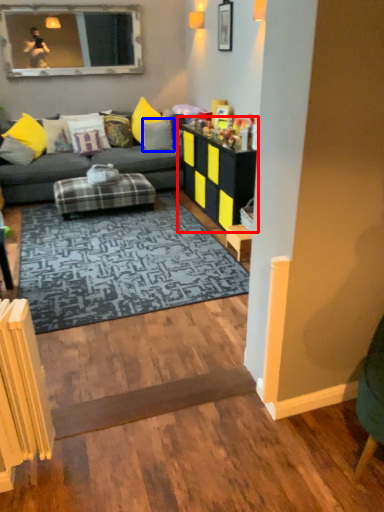
Question: Among these objects, which one is farthest to the camera, table (highlighted by a red box) or pillow (highlighted by a blue box)?

Choices:
 (A) table
 (B) pillow

Answer: (B)